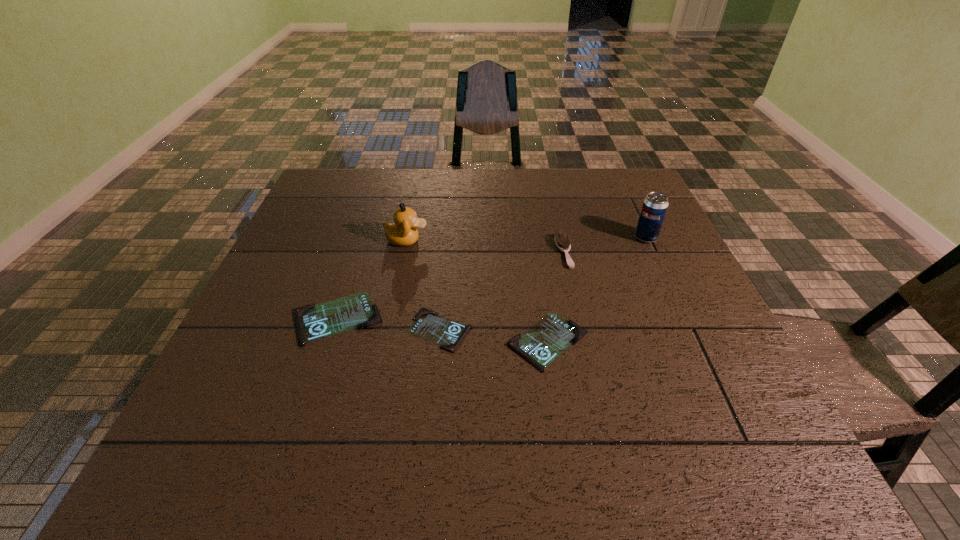
In order to click on vacant space at the far left corner of the desktop in this screenshot , I will do `click(339, 177)`.

In order to click on blank region between the leftmost identity card and the third tallest object in this screenshot , I will do `click(450, 285)`.

Identify the location of empty space that is in between the scrubbing brush and the duckling. (486, 246).

Image resolution: width=960 pixels, height=540 pixels. In order to click on unoccupied position between the rightmost object and the third tallest object in this screenshot , I will do `click(605, 245)`.

In order to click on unoccupied position between the rightmost object and the leftmost identity card in this screenshot , I will do `click(492, 278)`.

I want to click on blank region between the leftmost identity card and the scrubbing brush, so click(450, 285).

This screenshot has height=540, width=960. Identify the location of empty space that is in between the duckling and the scrubbing brush. (486, 246).

What are the coordinates of `free space between the scrubbing brush and the rightmost object` in the screenshot? It's located at (605, 245).

The height and width of the screenshot is (540, 960). Identify the location of unoccupied position between the duckling and the leftmost identity card. (372, 279).

At what (x,y) coordinates should I click in order to perform the action: click on free space between the beer can and the second tallest identity card. Please return your answer as a coordinate pair (x, y). Looking at the image, I should click on (597, 289).